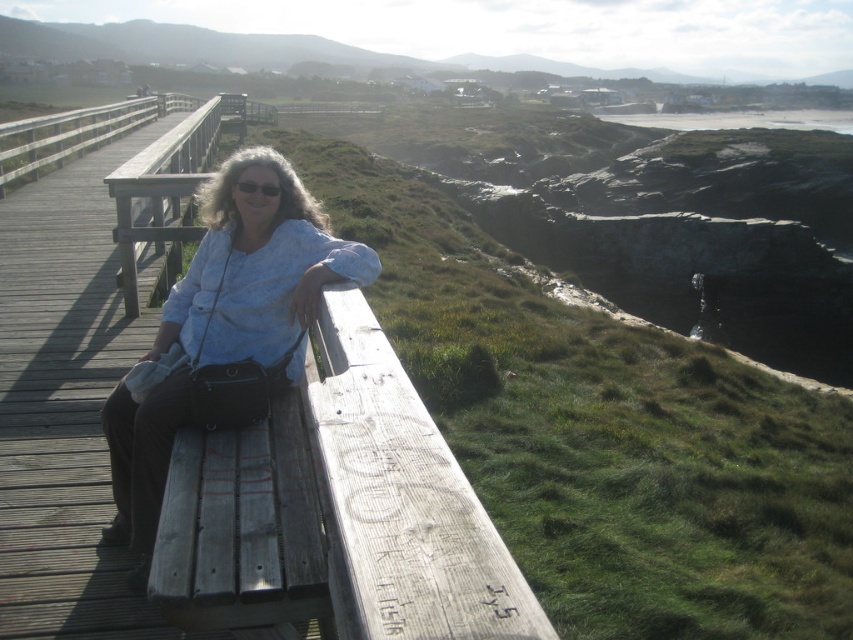
Question: Is weathered wood bench at left thinner than wooden at left?

Choices:
 (A) yes
 (B) no

Answer: (A)

Question: Based on their relative distances, which object is nearer to the matte blue shirt at center?

Choices:
 (A) weathered wood bench at left
 (B) wooden at left

Answer: (A)

Question: Which point is farther to the camera?

Choices:
 (A) (135, 456)
 (B) (225, 522)
 (C) (219, 112)

Answer: (C)

Question: Does matte blue shirt at center appear under wooden at left?

Choices:
 (A) no
 (B) yes

Answer: (B)

Question: Is matte blue shirt at center further to the viewer compared to wooden at left?

Choices:
 (A) yes
 (B) no

Answer: (B)

Question: Which point is farther to the camera?

Choices:
 (A) (x=328, y=276)
 (B) (x=422, y=468)

Answer: (A)